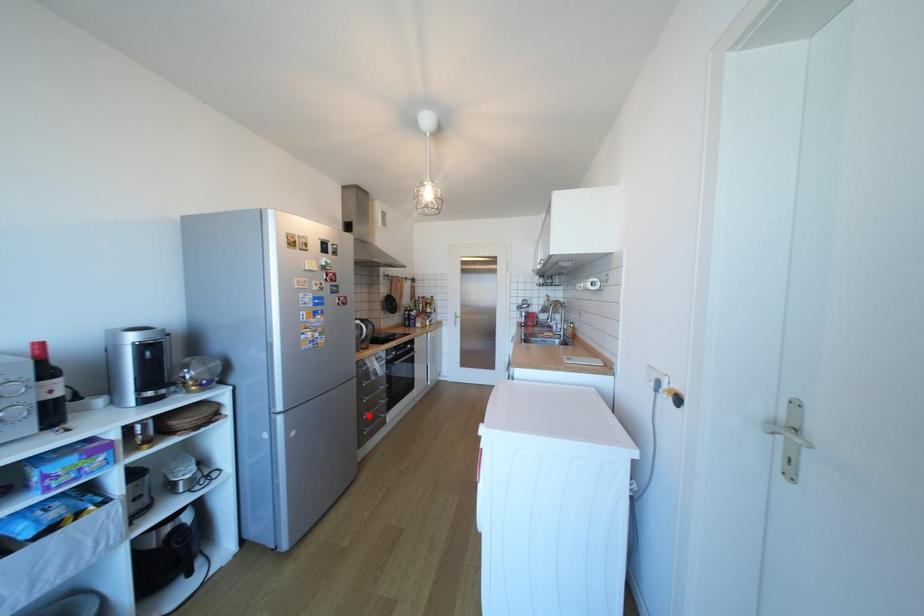
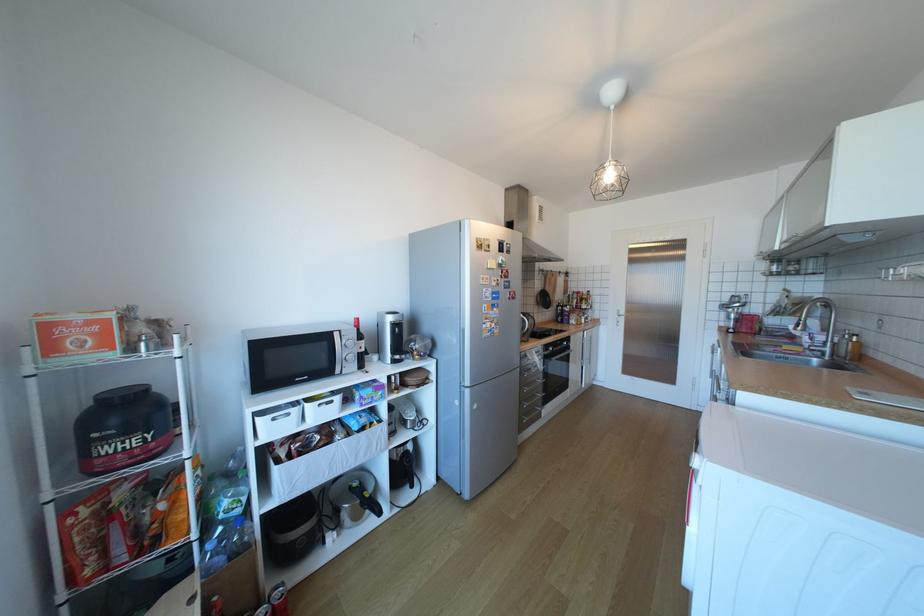
Question: A red point is marked in image1. In image2, is the corresponding 3D point closer to the camera or farther? Reply with the corresponding letter.

Choices:
 (A) The corresponding 3D point is closer.
 (B) The corresponding 3D point is farther.

Answer: (B)